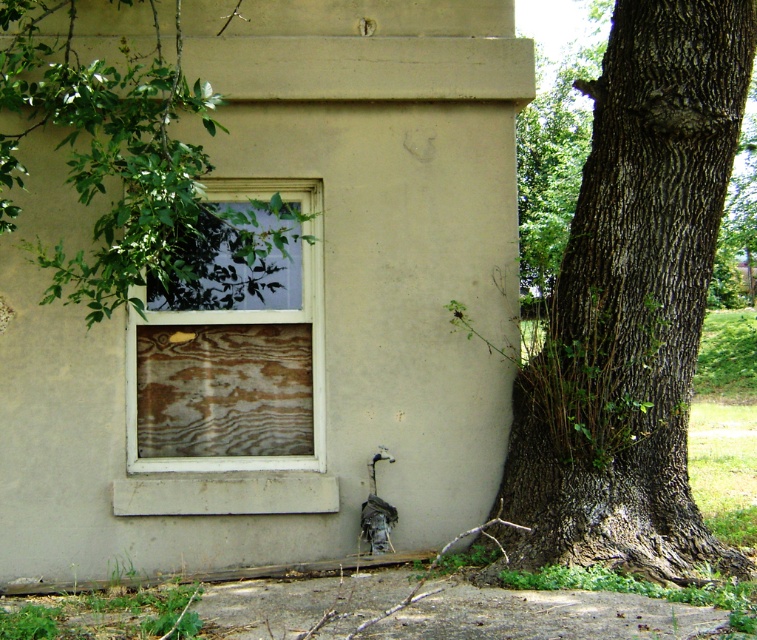
Question: Which point is closer to the camera?

Choices:
 (A) (734, 60)
 (B) (313, 186)

Answer: (A)

Question: Which object is farther from the camera taking this photo?

Choices:
 (A) wooden panel at center
 (B) dark brown textured bark at right

Answer: (A)

Question: Can you confirm if dark brown textured bark at right is thinner than wooden panel at center?

Choices:
 (A) no
 (B) yes

Answer: (A)

Question: Can you confirm if dark brown textured bark at right is positioned to the right of wooden panel at center?

Choices:
 (A) yes
 (B) no

Answer: (A)

Question: Can you confirm if dark brown textured bark at right is positioned to the right of wooden panel at center?

Choices:
 (A) no
 (B) yes

Answer: (B)